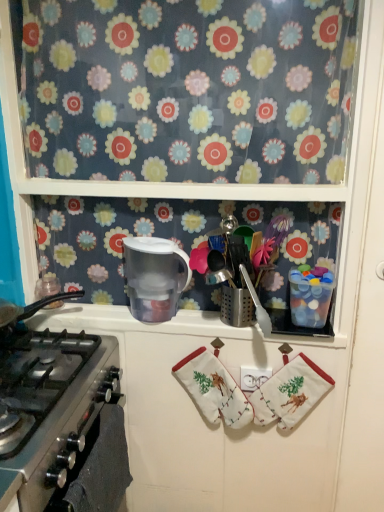
Question: Is the depth of floral fabric curtain at upper center less than that of white cotton hand towel at center, which ranks as the first hand towel in left-to-right order?

Choices:
 (A) yes
 (B) no

Answer: (A)

Question: Can you confirm if floral fabric curtain at upper center is wider than white cotton hand towel at center, which is the second hand towel from right to left?

Choices:
 (A) yes
 (B) no

Answer: (A)

Question: Is the surface of floral fabric curtain at upper center in direct contact with white cotton hand towel at center, which ranks as the first hand towel in left-to-right order?

Choices:
 (A) yes
 (B) no

Answer: (B)

Question: Is floral fabric curtain at upper center to the right of white cotton hand towel at center, which is the second hand towel from right to left, from the viewer's perspective?

Choices:
 (A) yes
 (B) no

Answer: (B)

Question: Considering the relative sizes of floral fabric curtain at upper center and white cotton hand towel at center, which ranks as the first hand towel in left-to-right order, in the image provided, is floral fabric curtain at upper center shorter than white cotton hand towel at center, which ranks as the first hand towel in left-to-right order,?

Choices:
 (A) yes
 (B) no

Answer: (B)

Question: Visually, is floral fabric curtain at upper center positioned to the left or to the right of white cotton hand towel at center, which ranks as the first hand towel in left-to-right order?

Choices:
 (A) right
 (B) left

Answer: (B)

Question: Considering their positions, is floral fabric curtain at upper center located in front of or behind white cotton hand towel at center, which ranks as the first hand towel in left-to-right order?

Choices:
 (A) front
 (B) behind

Answer: (A)

Question: Is point tap(241, 34) closer or farther from the camera than point tap(195, 365)?

Choices:
 (A) closer
 (B) farther

Answer: (A)

Question: Is floral fabric curtain at upper center inside or outside of white cotton hand towel at center, which ranks as the first hand towel in left-to-right order?

Choices:
 (A) outside
 (B) inside

Answer: (A)

Question: Considering the positions of floral fabric curtain at upper center and black matte oven at lower left in the image, is floral fabric curtain at upper center wider or thinner than black matte oven at lower left?

Choices:
 (A) thin
 (B) wide

Answer: (B)

Question: From the image's perspective, relative to black matte oven at lower left, is floral fabric curtain at upper center above or below?

Choices:
 (A) above
 (B) below

Answer: (A)

Question: From a real-world perspective, is floral fabric curtain at upper center positioned above or below black matte oven at lower left?

Choices:
 (A) below
 (B) above

Answer: (B)

Question: Considering the positions of floral fabric curtain at upper center and black matte oven at lower left in the image, is floral fabric curtain at upper center taller or shorter than black matte oven at lower left?

Choices:
 (A) short
 (B) tall

Answer: (B)

Question: Is black matte oven at lower left wider or thinner than transparent plastic pitcher at upper center, arranged as the 2th appliance when viewed from the right?

Choices:
 (A) thin
 (B) wide

Answer: (A)

Question: Visually, is black matte oven at lower left positioned to the left or to the right of transparent plastic pitcher at upper center, the 1th appliance positioned from the left?

Choices:
 (A) left
 (B) right

Answer: (A)